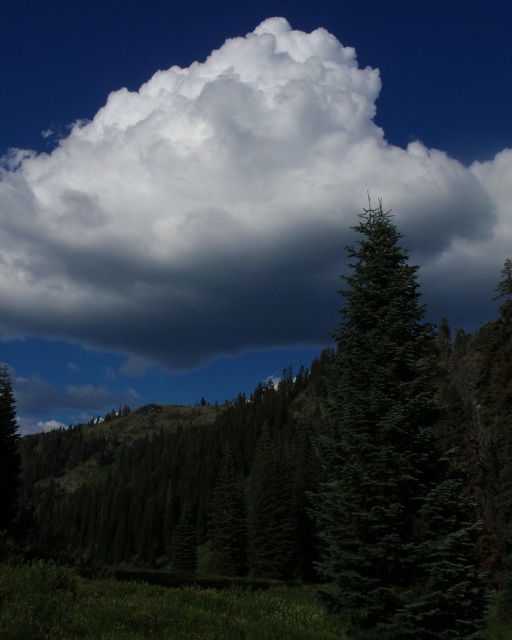
Question: Is white fluffy cloud at upper center smaller than green matte tree at center?

Choices:
 (A) no
 (B) yes

Answer: (A)

Question: Does green matte tree at center have a larger size compared to green matte tree at left?

Choices:
 (A) no
 (B) yes

Answer: (B)

Question: Which of these objects is positioned closest to the white fluffy cloud at upper center?

Choices:
 (A) green matte tree at left
 (B) green matte tree at center

Answer: (B)

Question: Which object is the closest to the green matte tree at center?

Choices:
 (A) green matte tree at left
 (B) white fluffy cloud at upper center

Answer: (A)

Question: Estimate the real-world distances between objects in this image. Which object is closer to the green matte tree at center?

Choices:
 (A) white fluffy cloud at upper center
 (B) green matte tree at left

Answer: (B)

Question: Does white fluffy cloud at upper center appear on the right side of green matte tree at center?

Choices:
 (A) no
 (B) yes

Answer: (A)